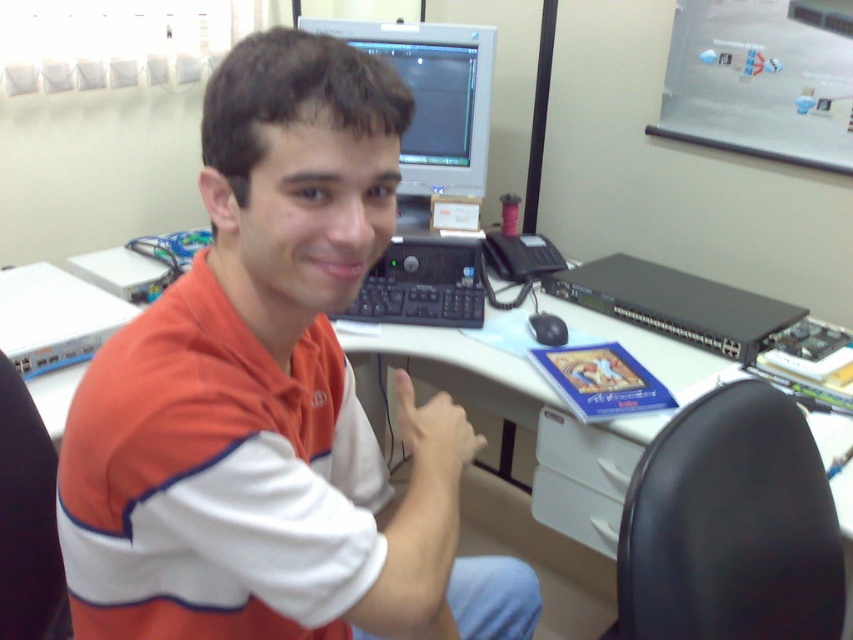
Image resolution: width=853 pixels, height=640 pixels. What do you see at coordinates (730, 525) in the screenshot? I see `black leather swivel chair at lower right` at bounding box center [730, 525].

This screenshot has height=640, width=853. Identify the location of black leather swivel chair at lower right. (730, 525).

This screenshot has width=853, height=640. In order to click on black leather swivel chair at lower right in this screenshot , I will do `click(730, 525)`.

Which of these two, black fabric chair at lower left or matte skin hand at center, stands shorter?

matte skin hand at center is shorter.

Is point (38, 576) farther from camera compared to point (444, 486)?

Yes, it is behind point (444, 486).

What do you see at coordinates (27, 518) in the screenshot? This screenshot has height=640, width=853. I see `black fabric chair at lower left` at bounding box center [27, 518].

Locate an element on the screen. black fabric chair at lower left is located at coordinates (27, 518).

Consider the image. Which of these two, orange cotton shirt at center or black fabric chair at lower left, stands taller?

Standing taller between the two is orange cotton shirt at center.

Who is higher up, orange cotton shirt at center or black fabric chair at lower left?

orange cotton shirt at center is above.

Where is `orange cotton shirt at center`? orange cotton shirt at center is located at coordinates click(267, 397).